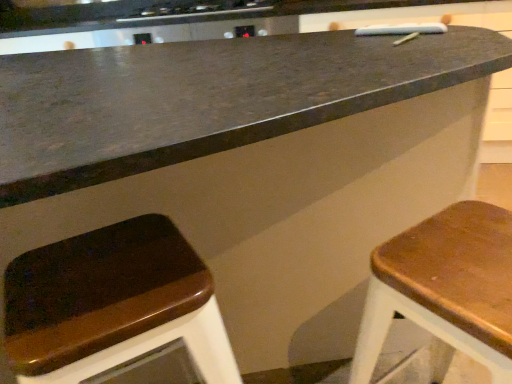
Identify the location of free location above wooden seat at lower left, the 2th stool positioned from the right (from a real-world perspective). This screenshot has width=512, height=384. (110, 269).